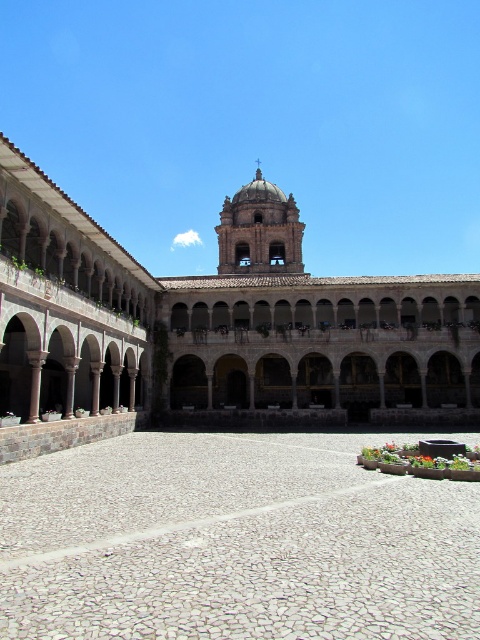
Question: Considering the relative positions of stone arches at center and white pebble courtyard at center in the image provided, where is stone arches at center located with respect to white pebble courtyard at center?

Choices:
 (A) above
 (B) below

Answer: (A)

Question: Is stone arches at center above white pebble courtyard at center?

Choices:
 (A) yes
 (B) no

Answer: (A)

Question: Is stone arches at center smaller than white pebble courtyard at center?

Choices:
 (A) yes
 (B) no

Answer: (B)

Question: Which point is farther from the camera taking this photo?

Choices:
 (A) (231, 548)
 (B) (49, 451)

Answer: (B)

Question: Among these objects, which one is farthest from the camera?

Choices:
 (A) stone arches at center
 (B) white pebble courtyard at center

Answer: (A)